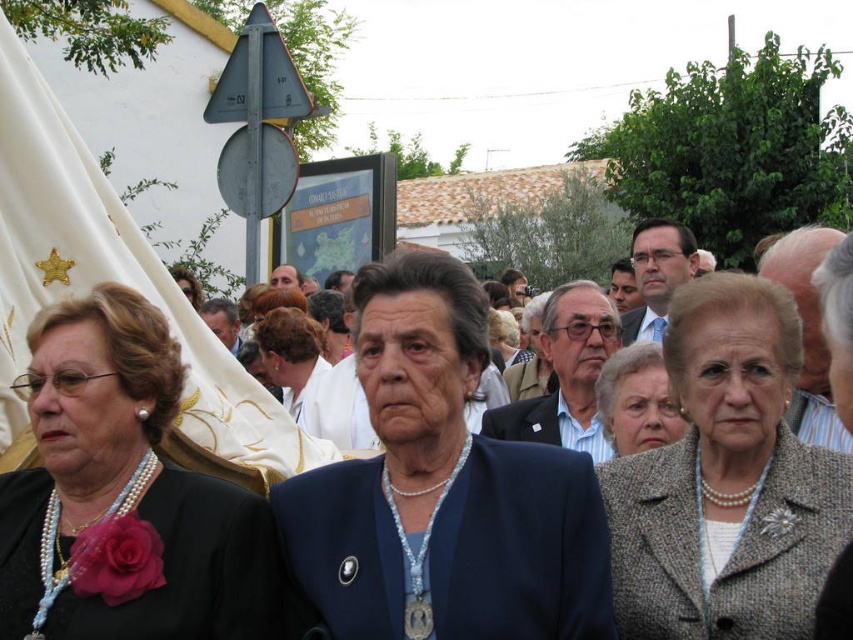
Question: Which is farther from the blue fabric jacket at center?

Choices:
 (A) light brown hair at center
 (B) pearl-gray tweed coat at center-right

Answer: (A)

Question: Is matte gray coat at center smaller than light brown hair at center?

Choices:
 (A) no
 (B) yes

Answer: (A)

Question: Can you confirm if pearl necklace at left is positioned to the right of pearl-gray tweed coat at center-right?

Choices:
 (A) yes
 (B) no

Answer: (B)

Question: Is blue fabric jacket at center closer to the viewer compared to matte gray coat at center?

Choices:
 (A) yes
 (B) no

Answer: (A)

Question: Which object is the farthest from the blue fabric jacket at center?

Choices:
 (A) matte gray coat at center
 (B) pearl necklace at left
 (C) pearl-gray tweed coat at center-right
 (D) light brown hair at center

Answer: (D)

Question: Among these objects, which one is nearest to the camera?

Choices:
 (A) pearl necklace at left
 (B) pearl-gray tweed coat at center-right
 (C) matte gray coat at center
 (D) light brown hair at center

Answer: (A)